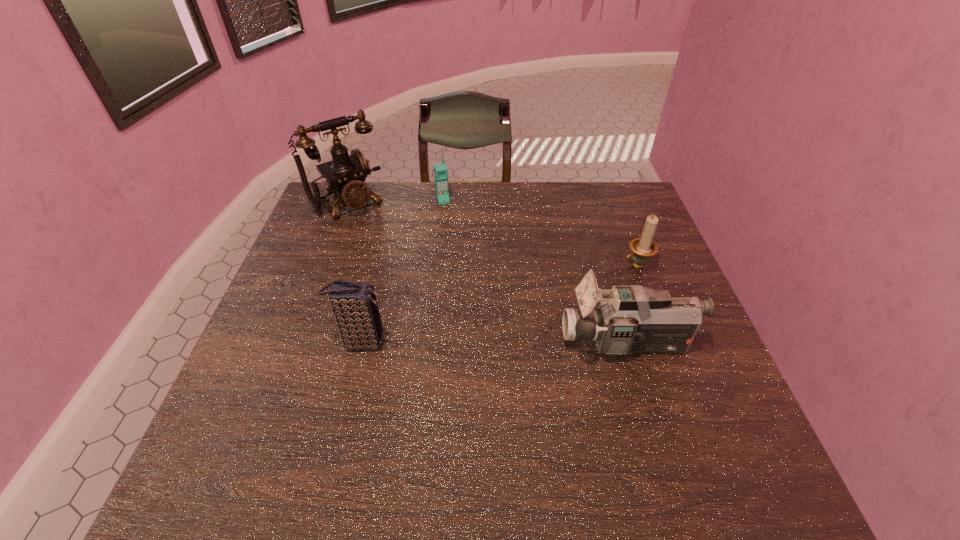
Identify the location of empty location between the candle_holder and the clutch bag. (499, 304).

Where is `vacant space that's between the clutch bag and the third object from right to left`? The width and height of the screenshot is (960, 540). vacant space that's between the clutch bag and the third object from right to left is located at coordinates (402, 272).

Where is `free space between the clutch bag and the tallest object`? The width and height of the screenshot is (960, 540). free space between the clutch bag and the tallest object is located at coordinates (356, 273).

This screenshot has width=960, height=540. I want to click on vacant region between the third object from left to right and the third nearest object, so click(x=540, y=233).

Identify the location of free spot between the third object from left to right and the camcorder. The height and width of the screenshot is (540, 960). (536, 272).

You are a GUI agent. You are given a task and a screenshot of the screen. Output one action in this format:
    pyautogui.click(x=<x>, y=<y>)
    Task: Click on the vacant area that lies between the cellular telephone and the candle_holder
    This screenshot has width=960, height=540.
    Given the screenshot: What is the action you would take?
    pyautogui.click(x=540, y=233)

The image size is (960, 540). What are the coordinates of `free area in between the tallest object and the third object from right to left` in the screenshot? It's located at (396, 202).

At what (x,y) coordinates should I click in order to perform the action: click on vacant area between the camcorder and the clutch bag. Please return your answer as a coordinate pair (x, y). This screenshot has height=540, width=960. Looking at the image, I should click on (494, 343).

This screenshot has width=960, height=540. I want to click on vacant area that lies between the third object from left to right and the telephone, so click(396, 202).

Find the location of `free space between the candle_holder and the tallest object`. free space between the candle_holder and the tallest object is located at coordinates (493, 234).